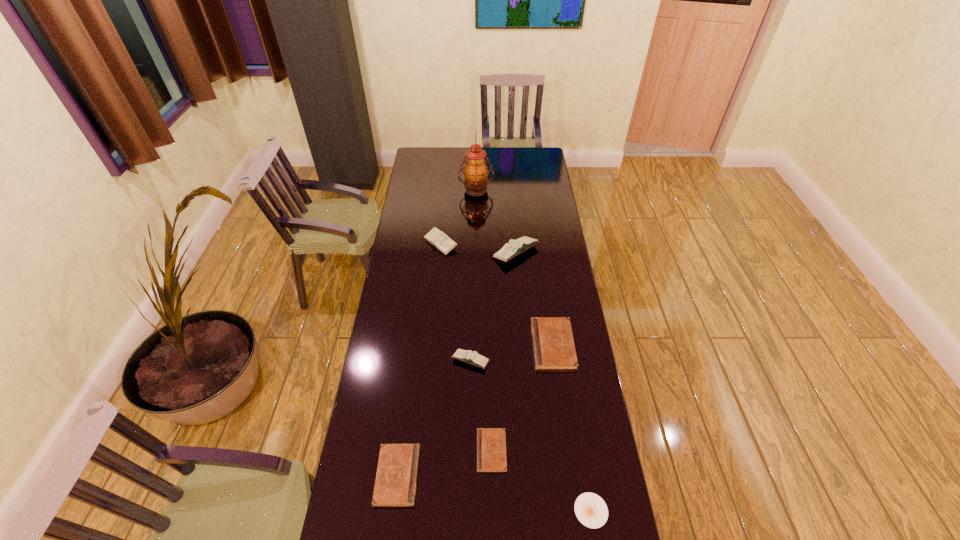
Locate an element on the screen. the leftmost brown diary is located at coordinates (396, 479).

This screenshot has width=960, height=540. I want to click on the fifth tallest diary, so click(396, 479).

Where is `the shortest diary`? the shortest diary is located at coordinates (491, 442).

The width and height of the screenshot is (960, 540). In order to click on the smallest brown diary in this screenshot , I will do `click(491, 442)`.

Locate an element on the screen. The width and height of the screenshot is (960, 540). white egg yolk is located at coordinates (591, 510).

This screenshot has height=540, width=960. I want to click on the shortest object, so click(x=591, y=510).

The image size is (960, 540). In order to click on vacant region located on the front of the tallest object in this screenshot , I will do 475,240.

I want to click on vacant space located 0.120m on the right of the biggest pink diary, so click(565, 252).

Locate an element on the screen. The image size is (960, 540). vacant region located 0.310m on the back of the second biggest pink diary is located at coordinates (445, 194).

I want to click on free space located 0.060m on the back of the nearest pink diary, so click(x=471, y=337).